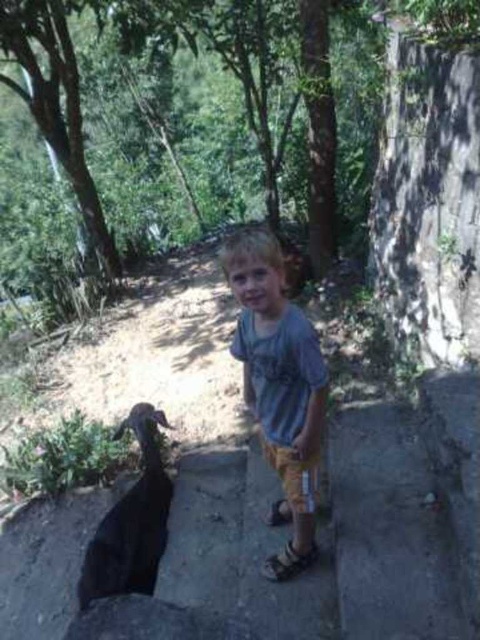
You are standing at point (139, 497) and want to walk to the child in the image. Which direction should you move relative to point (251, 378)?

You should move towards point (251, 378) because it is in front of point (139, 497), so moving towards it would lead you closer to the child.

You are a photographer trying to capture the child and the goat in a single frame. Given that the light blue cotton shirt at center is larger than the black matte goat at lower left, which object should you focus on first to ensure both are in the frame?

Since the light blue cotton shirt at center is larger than the black matte goat at lower left, you should focus on positioning the light blue cotton shirt at center first as it requires more space in the frame to accommodate its size, ensuring both objects fit within the camera view.

Based on the scene described, where is the light blue cotton shirt at center in relation to the black matte goat at lower left?

The light blue cotton shirt at center is to the right of the black matte goat at lower left.